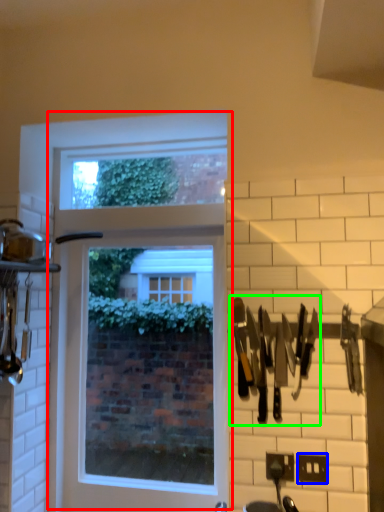
Question: Which object is positioned closest to window (highlighted by a red box)? Select from electric outlet (highlighted by a blue box) and cutlery (highlighted by a green box).

Choices:
 (A) electric outlet
 (B) cutlery

Answer: (B)